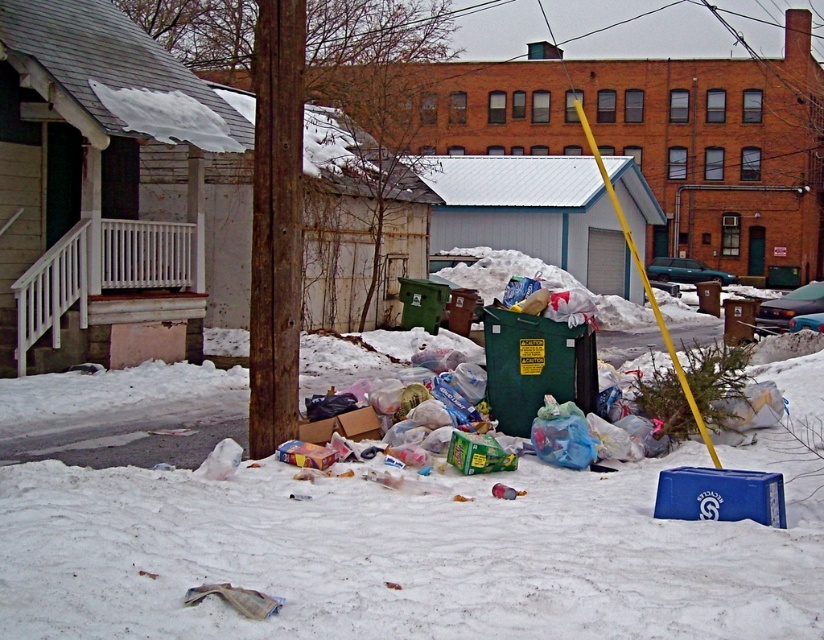
Which is above, white fluffy snow at lower center or yellow plastic pole at center right?

yellow plastic pole at center right

Identify the location of white fluffy snow at lower center. (405, 554).

Between point (551, 520) and point (661, 328), which one is positioned in front?

Point (551, 520) is in front.

At what (x,y) coordinates should I click in order to perform the action: click on white fluffy snow at lower center. Please return your answer as a coordinate pair (x, y). The width and height of the screenshot is (824, 640). Looking at the image, I should click on (405, 554).

Can you confirm if rusty wood pole at center is positioned below yellow plastic pole at center right?

No.

Does rusty wood pole at center have a greater height compared to yellow plastic pole at center right?

Incorrect, rusty wood pole at center's height is not larger of yellow plastic pole at center right's.

Which is in front, point (270, 284) or point (620, 211)?

Positioned in front is point (270, 284).

The image size is (824, 640). I want to click on rusty wood pole at center, so click(x=275, y=225).

Does white fluffy snow at lower center appear on the right side of rusty wood pole at center?

Indeed, white fluffy snow at lower center is positioned on the right side of rusty wood pole at center.

Is point (485, 570) farther from camera compared to point (279, 417)?

That is False.

Who is more distant from viewer, (293, 634) or (295, 88)?

Point (295, 88)

In order to click on white fluffy snow at lower center in this screenshot , I will do `click(405, 554)`.